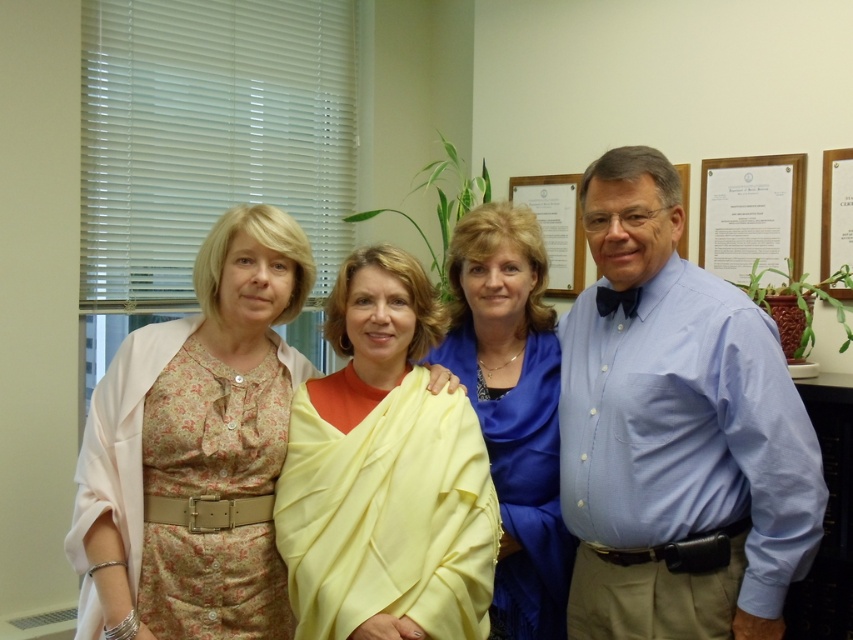
Based on the scene description, where is the yellow satin shawl at center located in terms of its 2D coordinates?

The yellow satin shawl at center is located at the 2D coordinates of point (386, 474).

You are an office assistant who needs to hang a new certificate on the wall. The certificate is 1.2 meters tall. The blue shirt at right and wooden plaque at upper right are already on the wall. Can you hang the certificate between them without overlapping?

The blue shirt at right is much taller than the wooden plaque at upper right. Since the certificate is 1.2 meters tall, it might not fit between them if the distance between the two objects is less than 1.2 meters. However, the exact spacing isn not provided, so it depends on the available space between them.

You are a photographer standing at the camera position. You want to adjust your zoom lens to ensure the blue satin blouse at center is the main focus. What should you do with the zoom lens?

Since the blue satin blouse at center and camera are 6.08 feet apart, you should zoom in to make the blouse the main focus while maintaining the distance between them.